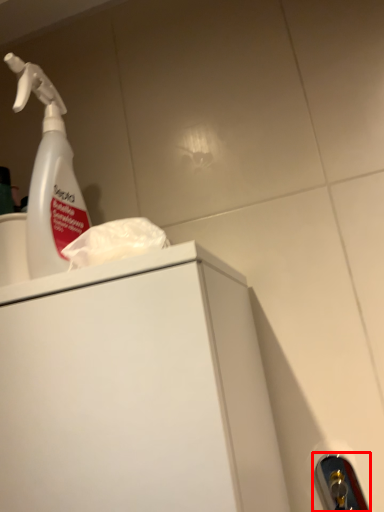
Question: From the image, what is the correct spatial relationship of door handle (annotated by the red box) in relation to cleaning product?

Choices:
 (A) left
 (B) right

Answer: (B)